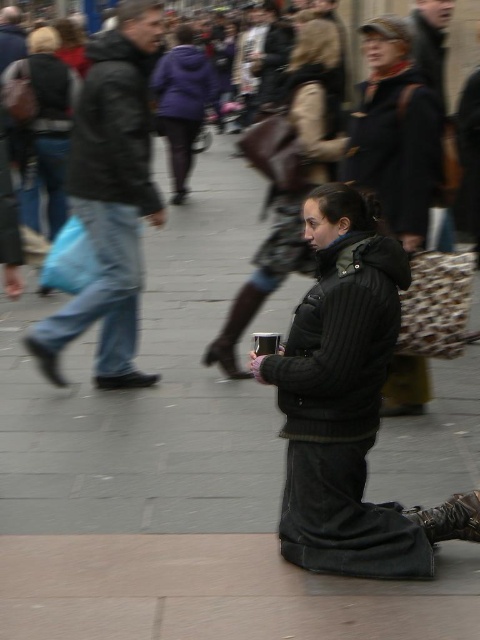
Question: Which object appears closest to the camera in this image?

Choices:
 (A) pink fabric boot at center
 (B) black woolen coat at center

Answer: (B)

Question: Is black textured coat at center thinner than black woolen coat at center?

Choices:
 (A) yes
 (B) no

Answer: (A)

Question: Does black textured coat at center appear on the left side of leather boot at lower right?

Choices:
 (A) yes
 (B) no

Answer: (B)

Question: Which of the following is the farthest from the observer?

Choices:
 (A) (479, 497)
 (B) (227, 330)
 (C) (98, 248)

Answer: (B)

Question: Estimate the real-world distances between objects in this image. Which object is farther from the black woolen coat at center?

Choices:
 (A) gray concrete pavement at center
 (B) pink fabric boot at center
 (C) leather boot at lower right

Answer: (C)

Question: Is black textured coat at center closer to the viewer compared to black woolen coat at center?

Choices:
 (A) yes
 (B) no

Answer: (A)